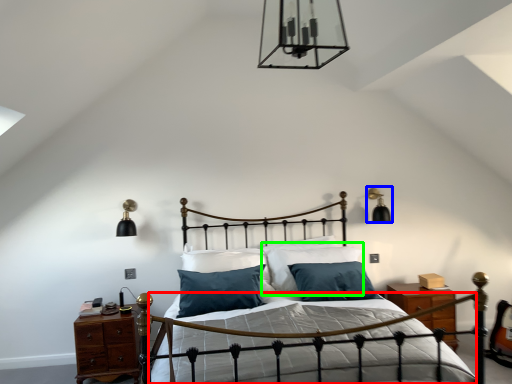
Question: Based on their relative distances, which object is farther from bed frame (highlighted by a red box)? Choose from light fixture (highlighted by a blue box) and pillow (highlighted by a green box).

Choices:
 (A) light fixture
 (B) pillow

Answer: (A)